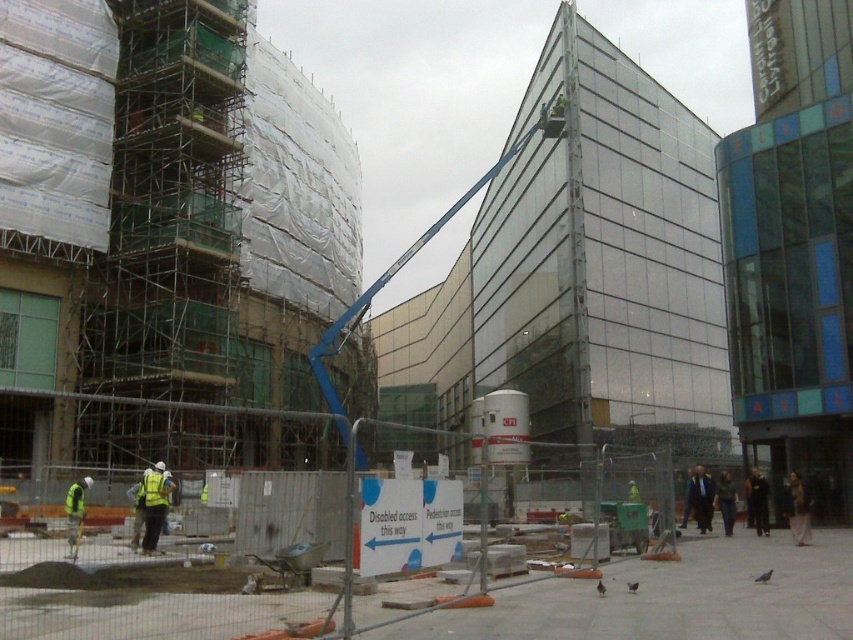
Question: Estimate the real-world distances between objects in this image. Which object is farther from the reflective yellow vest at lower left?

Choices:
 (A) yellow reflective safety vest at lower left
 (B) silver metallic scaffolding at left
 (C) green reflective safety vest at lower left

Answer: (B)

Question: Which point is closer to the camera taking this photo?

Choices:
 (A) (231, 317)
 (B) (73, 490)

Answer: (B)

Question: Is reflective yellow vest at lower left to the left of yellow reflective safety vest at lower left from the viewer's perspective?

Choices:
 (A) yes
 (B) no

Answer: (A)

Question: Is reflective yellow vest at lower left to the left of green reflective safety vest at lower left from the viewer's perspective?

Choices:
 (A) yes
 (B) no

Answer: (B)

Question: Which object is positioned farthest from the yellow reflective safety vest at lower left?

Choices:
 (A) reflective yellow vest at lower left
 (B) green reflective safety vest at lower left

Answer: (B)

Question: Is silver metallic scaffolding at left below yellow reflective safety vest at lower left?

Choices:
 (A) yes
 (B) no

Answer: (B)